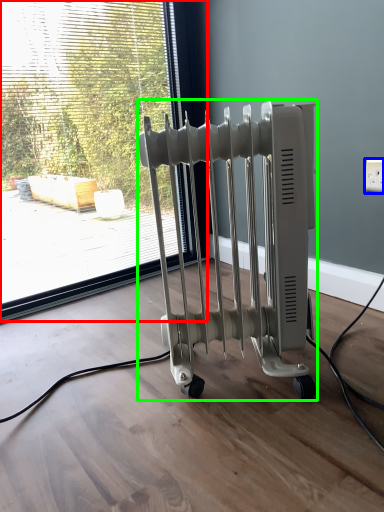
Question: Which is nearer to the window (highlighted by a red box)? electric outlet (highlighted by a blue box) or bath heater (highlighted by a green box).

Choices:
 (A) electric outlet
 (B) bath heater

Answer: (B)